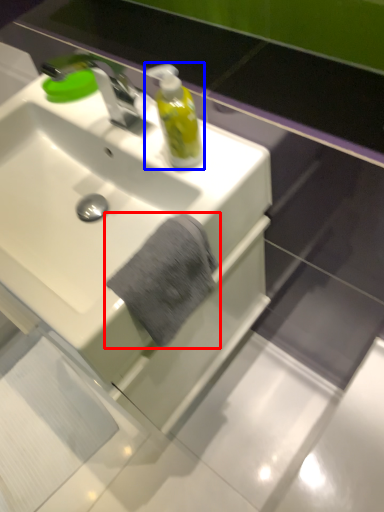
Question: Which point is closer to the camera, bath towel (highlighted by a red box) or mouthwash (highlighted by a blue box)?

Choices:
 (A) bath towel
 (B) mouthwash

Answer: (A)